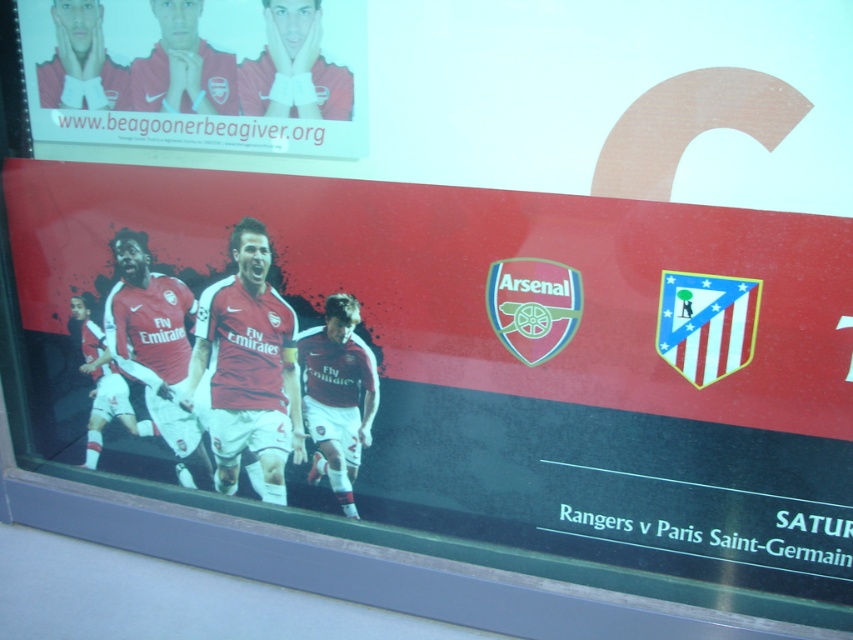
Question: Is matte red jersey at center in front of matte red jersey at upper left?

Choices:
 (A) no
 (B) yes

Answer: (B)

Question: From the image, what is the correct spatial relationship of matte red jersey at center in relation to matte red jersey at upper left?

Choices:
 (A) below
 (B) above

Answer: (A)

Question: Which of the following is the farthest from the observer?

Choices:
 (A) (207, 145)
 (B) (585, 252)

Answer: (A)

Question: Is matte red jersey at center to the right of matte red jersey at upper left from the viewer's perspective?

Choices:
 (A) no
 (B) yes

Answer: (B)